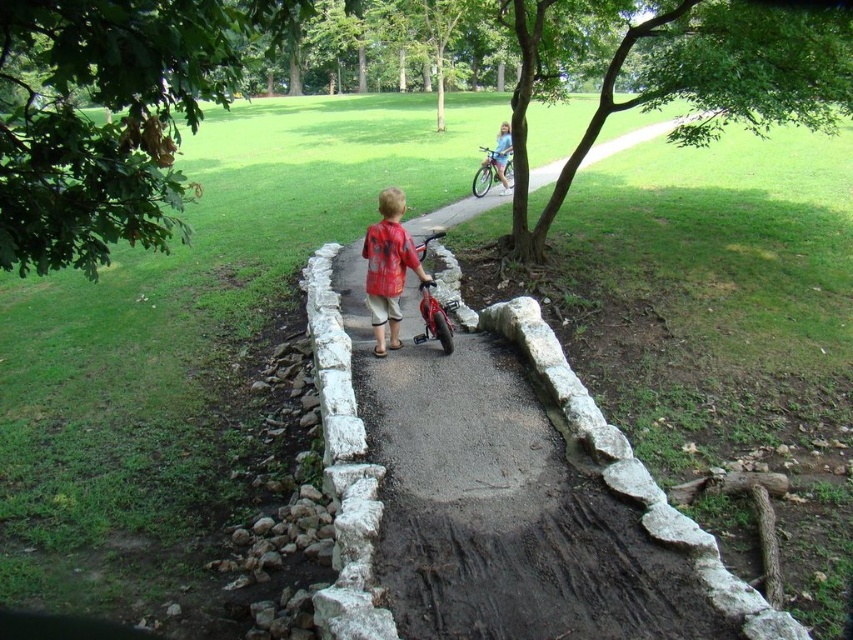
You are standing at the point marked as point (109, 118) in the park scene. What object is located exactly at this point?

The point (109, 118) corresponds to the green leafy tree at upper left.

You are standing at the camera position and want to place a 2.5 meter long bench between yourself and the green leafy tree at upper left. Is there enough space?

The distance between the green leafy tree at upper left and the camera is 2.08 meters. Since the bench is 2.5 meters long, it won